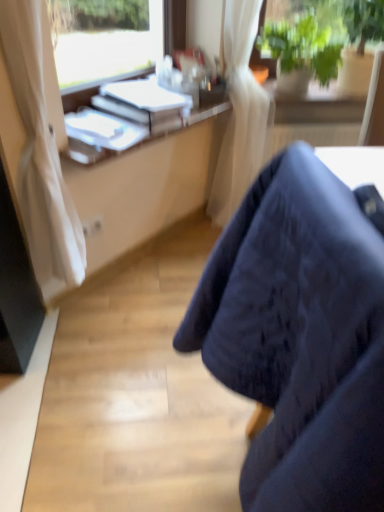
Question: Can you confirm if white plastic desk at upper left is wider than white paper at upper center, which ranks as the second book in bottom-to-top order?

Choices:
 (A) no
 (B) yes

Answer: (A)

Question: From a real-world perspective, does white plastic desk at upper left stand above white paper at upper center, which ranks as the second book in bottom-to-top order?

Choices:
 (A) yes
 (B) no

Answer: (B)

Question: Does white plastic desk at upper left come behind white paper at upper center, which ranks as the second book in bottom-to-top order?

Choices:
 (A) yes
 (B) no

Answer: (B)

Question: Would you say white plastic desk at upper left contains white paper at upper center, which ranks as the second book in bottom-to-top order?

Choices:
 (A) yes
 (B) no

Answer: (B)

Question: Is white plastic desk at upper left far from white paper at upper center, which is the 1th book from top to bottom?

Choices:
 (A) no
 (B) yes

Answer: (A)

Question: Does white plastic desk at upper left have a larger size compared to white paper at upper center, which ranks as the second book in bottom-to-top order?

Choices:
 (A) yes
 (B) no

Answer: (B)

Question: Can you confirm if white glossy book at upper left, arranged as the second book when viewed from the top, is positioned to the right of green leafy plant at upper right?

Choices:
 (A) no
 (B) yes

Answer: (A)

Question: Can you confirm if white glossy book at upper left, arranged as the second book when viewed from the top, is bigger than green leafy plant at upper right?

Choices:
 (A) no
 (B) yes

Answer: (A)

Question: Can green leafy plant at upper right be found inside white glossy book at upper left, arranged as the second book when viewed from the top?

Choices:
 (A) yes
 (B) no

Answer: (B)

Question: Can you confirm if white glossy book at upper left, placed as the 1th book when sorted from bottom to top, is shorter than green leafy plant at upper right?

Choices:
 (A) no
 (B) yes

Answer: (B)

Question: From the image's perspective, does white glossy book at upper left, arranged as the second book when viewed from the top, appear higher than green leafy plant at upper right?

Choices:
 (A) yes
 (B) no

Answer: (B)

Question: From the image's perspective, is white plastic desk at upper left beneath white glossy book at upper left, placed as the 1th book when sorted from bottom to top?

Choices:
 (A) yes
 (B) no

Answer: (B)